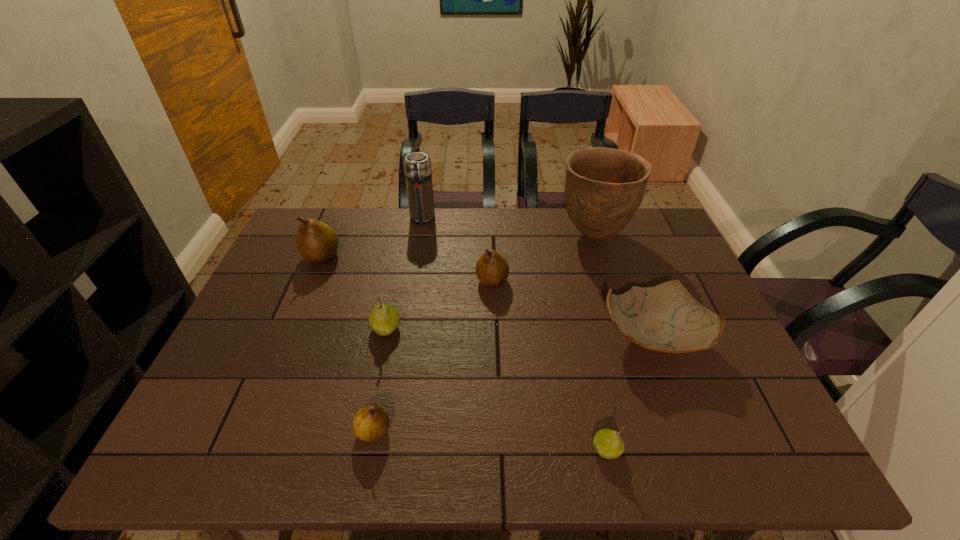
The width and height of the screenshot is (960, 540). In order to click on vacant region that satisfies the following two spatial constraints: 1. with a handle on the side of the seventh shortest object; 2. on the right side of the fourth pear from left to right in this screenshot , I will do `click(412, 281)`.